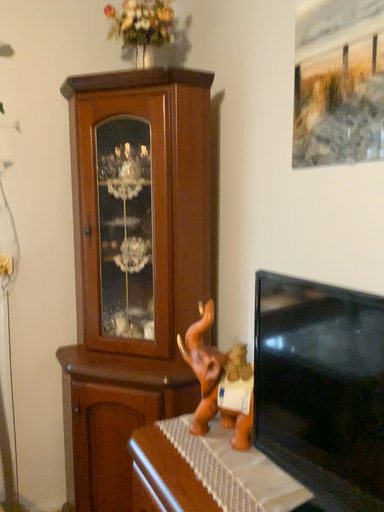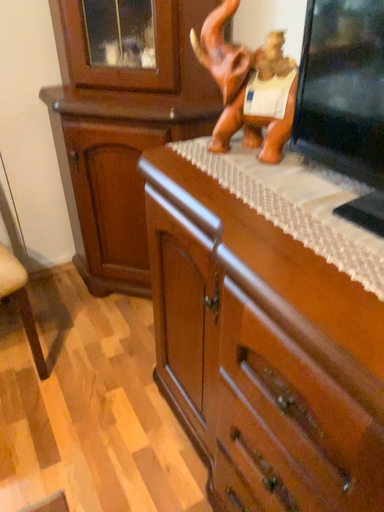
Question: Which way did the camera rotate in the video?

Choices:
 (A) rotated upward
 (B) rotated downward

Answer: (B)